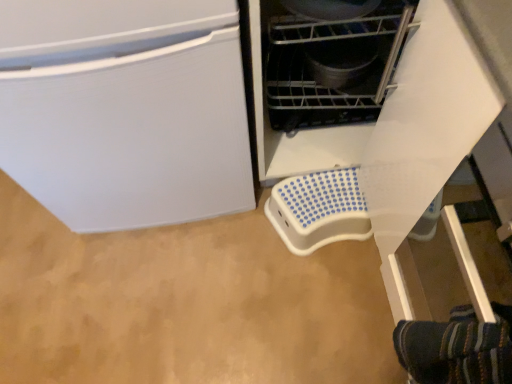
Question: Considering the relative positions of metallic gray pot at center, the second appliance ordered from the bottom, and white plastic step stool at lower center, the 1th appliance when ordered from back to front, in the image provided, is metallic gray pot at center, the second appliance ordered from the bottom, in front of white plastic step stool at lower center, the 1th appliance when ordered from back to front,?

Choices:
 (A) no
 (B) yes

Answer: (B)

Question: Can you confirm if metallic gray pot at center, marked as the 1th appliance in a top-to-bottom arrangement, is taller than white plastic step stool at lower center, the 1th appliance when ordered from back to front?

Choices:
 (A) no
 (B) yes

Answer: (B)

Question: Can you confirm if metallic gray pot at center, the 1th appliance when ordered from front to back, is positioned to the left of white plastic step stool at lower center, acting as the second appliance starting from the top?

Choices:
 (A) no
 (B) yes

Answer: (B)

Question: Is metallic gray pot at center, the second appliance ordered from the bottom, positioned beyond the bounds of white plastic step stool at lower center, placed as the first appliance when sorted from bottom to top?

Choices:
 (A) no
 (B) yes

Answer: (B)

Question: Would you say white plastic step stool at lower center, the 1th appliance when ordered from back to front, is part of metallic gray pot at center, marked as the 1th appliance in a top-to-bottom arrangement,'s contents?

Choices:
 (A) no
 (B) yes

Answer: (A)

Question: From the image's perspective, is metallic gray pot at center, the second appliance ordered from the bottom, beneath white plastic step stool at lower center, the second appliance from the front?

Choices:
 (A) yes
 (B) no

Answer: (B)

Question: From a real-world perspective, is white plastic step stool at lower center, acting as the second appliance starting from the top, beneath metallic gray pot at center, the 1th appliance when ordered from front to back?

Choices:
 (A) no
 (B) yes

Answer: (B)

Question: Does white plastic step stool at lower center, the 1th appliance when ordered from back to front, have a lesser width compared to metallic gray pot at center, the 1th appliance when ordered from front to back?

Choices:
 (A) yes
 (B) no

Answer: (B)

Question: Is white plastic step stool at lower center, the second appliance from the front, to the right of metallic gray pot at center, marked as the 1th appliance in a top-to-bottom arrangement, from the viewer's perspective?

Choices:
 (A) no
 (B) yes

Answer: (B)

Question: Does white plastic step stool at lower center, acting as the second appliance starting from the top, appear on the left side of metallic gray pot at center, marked as the 1th appliance in a top-to-bottom arrangement?

Choices:
 (A) no
 (B) yes

Answer: (A)

Question: Is white plastic step stool at lower center, acting as the second appliance starting from the top, further to camera compared to metallic gray pot at center, placed as the second appliance when sorted from back to front?

Choices:
 (A) no
 (B) yes

Answer: (B)

Question: From the image's perspective, is white plastic step stool at lower center, the second appliance from the front, beneath metallic gray pot at center, the second appliance ordered from the bottom?

Choices:
 (A) yes
 (B) no

Answer: (A)

Question: In the image, is metallic gray pot at center, marked as the 1th appliance in a top-to-bottom arrangement, positioned in front of or behind white plastic step stool at lower center, the 1th appliance when ordered from back to front?

Choices:
 (A) front
 (B) behind

Answer: (A)